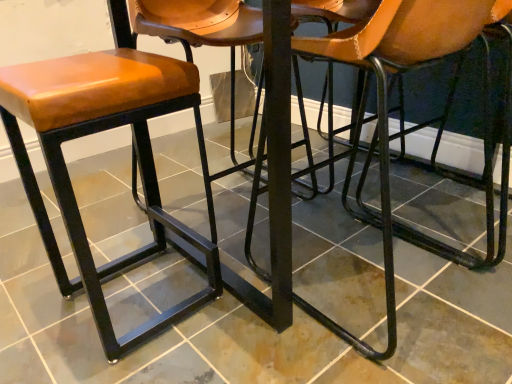
Locate an element on the screen. The width and height of the screenshot is (512, 384). vacant area that is situated to the right of matte brown leather stool at left is located at coordinates point(244,310).